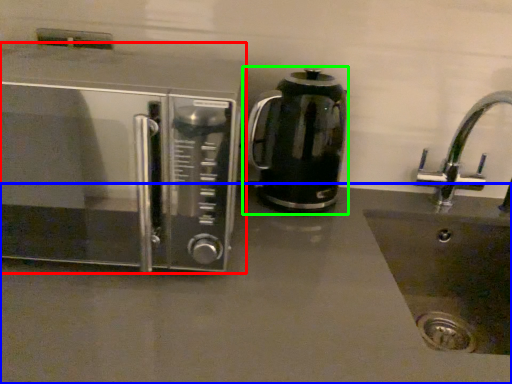
Question: Based on their relative distances, which object is farther from microwave oven (highlighted by a red box)? Choose from counter top (highlighted by a blue box) and kitchen appliance (highlighted by a green box).

Choices:
 (A) counter top
 (B) kitchen appliance

Answer: (A)